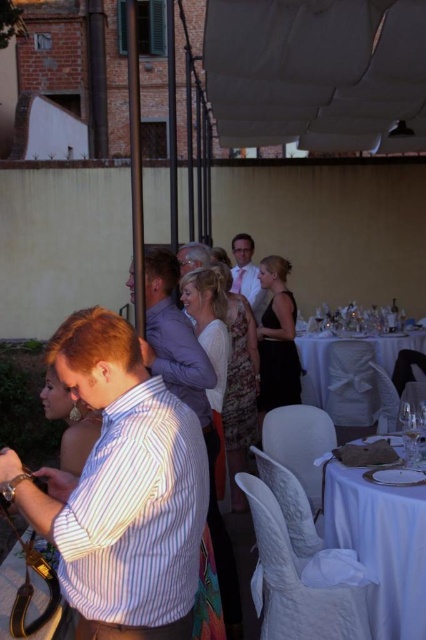
Question: Is white satin table at center positioned at the back of white satin tie at center?

Choices:
 (A) yes
 (B) no

Answer: (B)

Question: Is white satin table at center smaller than white satin tie at center?

Choices:
 (A) no
 (B) yes

Answer: (A)

Question: Which point is closer to the camera?

Choices:
 (A) white satin table at center
 (B) clear glass wine glass at center

Answer: (B)

Question: Does white satin table at center appear on the left side of clear glass wine glass at center?

Choices:
 (A) yes
 (B) no

Answer: (B)

Question: Which point is closer to the camera?

Choices:
 (A) (259, 284)
 (B) (146, 362)

Answer: (B)

Question: Among these objects, which one is farthest from the camera?

Choices:
 (A) striped shirt at center
 (B) clear glass wine glass at center
 (C) white satin table at center
 (D) white satin tablecloth at lower right

Answer: (C)